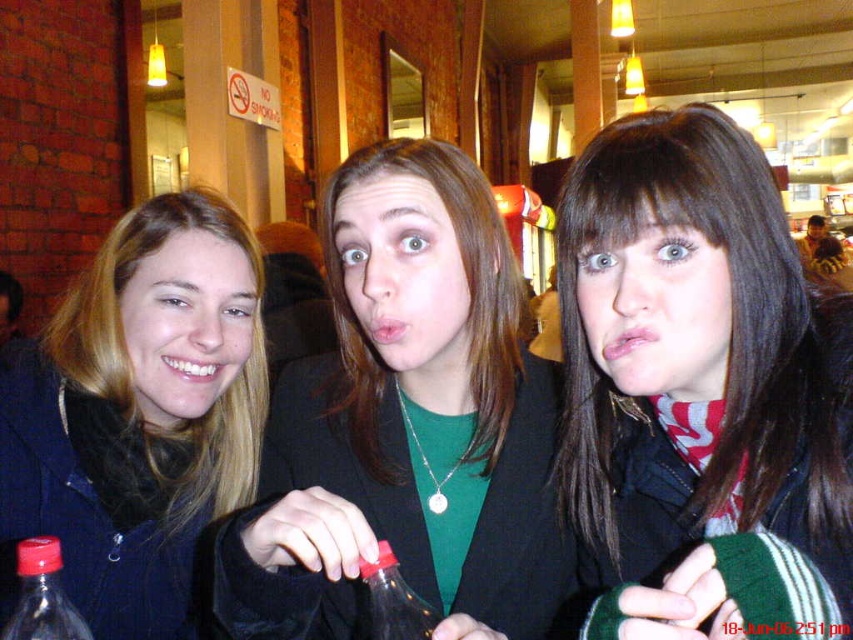
Question: Estimate the real-world distances between objects in this image. Which object is closer to the dark brown hair at center?

Choices:
 (A) matte black jacket at left
 (B) green matte shirt at center
 (C) translucent plastic bottle at lower left

Answer: (B)

Question: Does dark brown hair at center have a greater width compared to translucent plastic bottle at lower left?

Choices:
 (A) yes
 (B) no

Answer: (A)

Question: Does dark brown hair at center appear on the left side of translucent plastic bottle at lower left?

Choices:
 (A) yes
 (B) no

Answer: (B)

Question: Which point is closer to the camera taking this photo?

Choices:
 (A) (520, 440)
 (B) (242, 356)
 (C) (718, 314)
 (D) (416, 616)

Answer: (D)

Question: Which point appears closest to the camera in this image?

Choices:
 (A) (514, 547)
 (B) (715, 486)
 (C) (10, 620)
 (D) (384, 547)

Answer: (D)

Question: Is green matte shirt at center below transparent plastic bottle at center?

Choices:
 (A) no
 (B) yes

Answer: (A)